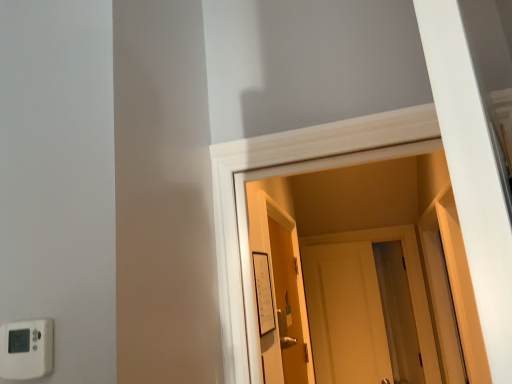
Question: Is white matte door at center, acting as the 2th door starting from the left, surrounding white plastic thermostat at lower left, positioned as the 1th light switch in left-to-right order?

Choices:
 (A) no
 (B) yes

Answer: (A)

Question: Is white matte door at center, which is the first door from right to left, outside of white plastic thermostat at lower left, the second light switch in the right-to-left sequence?

Choices:
 (A) yes
 (B) no

Answer: (A)

Question: Is white matte door at center, acting as the 2th door starting from the left, with white plastic thermostat at lower left, the second light switch positioned from the back?

Choices:
 (A) yes
 (B) no

Answer: (B)

Question: Can you confirm if white matte door at center, acting as the 2th door starting from the left, is bigger than white plastic thermostat at lower left, the second light switch in the right-to-left sequence?

Choices:
 (A) no
 (B) yes

Answer: (B)

Question: Does white matte door at center, acting as the 2th door starting from the left, have a smaller size compared to white plastic thermostat at lower left, positioned as the 1th light switch in left-to-right order?

Choices:
 (A) yes
 (B) no

Answer: (B)

Question: Is white matte door at center, which is the first door from right to left, positioned before white plastic thermostat at lower left, the first light switch when ordered from front to back?

Choices:
 (A) no
 (B) yes

Answer: (A)

Question: Is wooden door at center, marked as the 1th door in a left-to-right arrangement, closer to camera compared to white matte door at center, which is the first door from right to left?

Choices:
 (A) no
 (B) yes

Answer: (B)

Question: Is wooden door at center, positioned as the 1th door in front-to-back order, facing away from white matte door at center, which is the second door in front-to-back order?

Choices:
 (A) no
 (B) yes

Answer: (A)

Question: From the image's perspective, is wooden door at center, positioned as the 1th door in front-to-back order, under white matte door at center, which is the 1th door from back to front?

Choices:
 (A) yes
 (B) no

Answer: (B)

Question: Is wooden door at center, marked as the 1th door in a left-to-right arrangement, outside white matte door at center, acting as the 2th door starting from the left?

Choices:
 (A) no
 (B) yes

Answer: (B)

Question: Is white matte door at center, which is the second door in front-to-back order, a part of wooden door at center, positioned as the 1th door in front-to-back order?

Choices:
 (A) yes
 (B) no

Answer: (B)

Question: Considering the relative sizes of wooden door at center, positioned as the 1th door in front-to-back order, and white matte door at center, which is the 1th door from back to front, in the image provided, is wooden door at center, positioned as the 1th door in front-to-back order, shorter than white matte door at center, which is the 1th door from back to front,?

Choices:
 (A) yes
 (B) no

Answer: (A)

Question: Does white plastic thermostat at lower left, the second light switch positioned from the back, have a larger size compared to white paper at center, the 1th light switch viewed from the back?

Choices:
 (A) no
 (B) yes

Answer: (A)